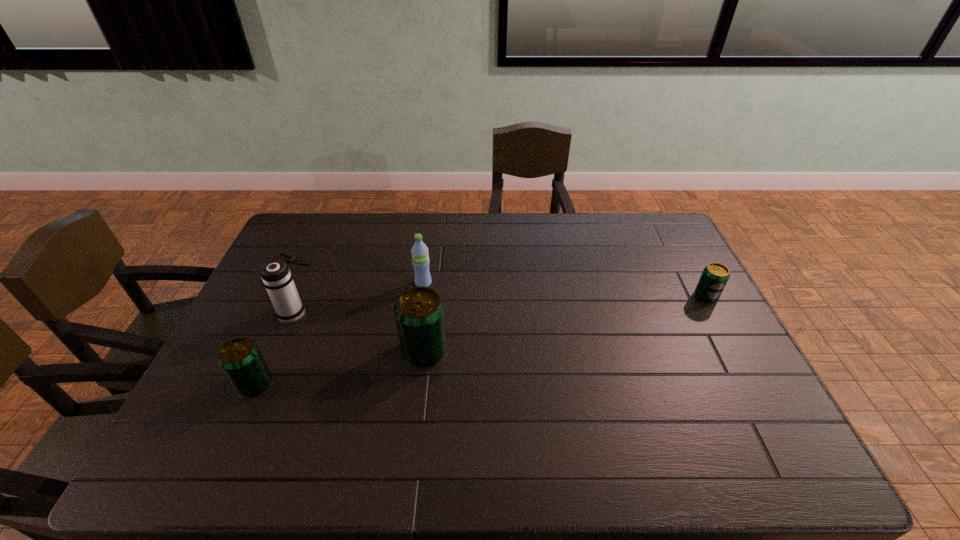
Image resolution: width=960 pixels, height=540 pixels. I want to click on thermos bottle that is at the left edge, so click(276, 276).

Identify the location of object that is positioned at the right edge. Image resolution: width=960 pixels, height=540 pixels. (715, 276).

You are a GUI agent. You are given a task and a screenshot of the screen. Output one action in this format:
    pyautogui.click(x=<x>, y=<y>)
    Task: Click on the object at the near left corner
    
    Given the screenshot: What is the action you would take?
    pyautogui.click(x=241, y=360)

At what (x,y) coordinates should I click in order to perform the action: click on free location at the far edge. Please return your answer as a coordinate pair (x, y). The height and width of the screenshot is (540, 960). Looking at the image, I should click on (498, 244).

The height and width of the screenshot is (540, 960). In order to click on vacant area at the near edge of the desktop in this screenshot , I will do `click(462, 416)`.

Locate an element on the screen. free space at the left edge of the desktop is located at coordinates (276, 364).

In the image, there is a desktop. What are the coordinates of `vacant area at the right edge` in the screenshot? It's located at (656, 276).

Identify the location of vacant area at the far right corner of the desktop. (649, 218).

In the image, there is a desktop. Identify the location of vacant space at the near right corner. (756, 405).

I want to click on free space between the water bottle and the thermos bottle, so [x=358, y=299].